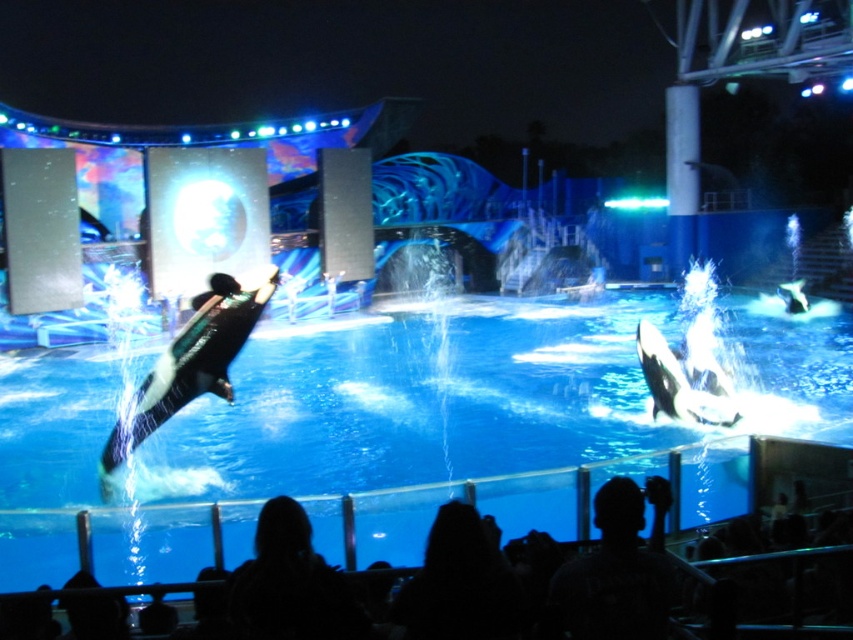
You are a photographer positioned at the front of the marine show. You want to capture both the black matte orca at center and the black and white smooth orca at center in a single frame. Based on their positions, which orca is wider and might require more space in your camera view?

The black matte orca at center might be wider than the black and white smooth orca at center, so you should adjust your camera view to accommodate its width to ensure both are fully captured.

You are a photographer at the marine show. You need to capture a photo where both the black smooth dolphin at center and the black and white smooth orca at center are visible. Which direction should you position your camera to ensure both are in the frame?

Position your camera to the right side of the scene so that both the black smooth dolphin at center and the black and white smooth orca at center are visible. Since the black smooth dolphin at center is to the left of the black and white smooth orca at center, aligning the camera to the right will keep both within the frame.

You are a marine trainer preparing to place a new feeding station between the black smooth dolphin at center and the black and white smooth orca at center. Based on their widths, which animal requires more space for the feeding station to accommodate its size?

The black smooth dolphin at center is wider than the black and white smooth orca at center, so the feeding station needs to be placed to accommodate the dolphin first.